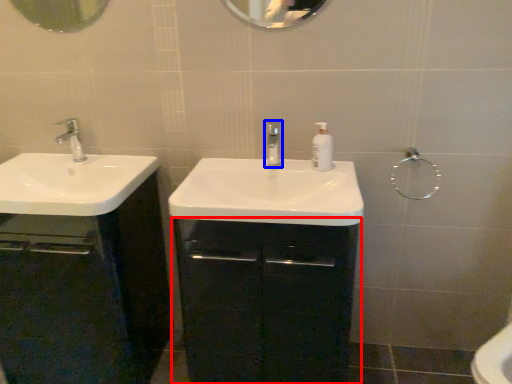
Question: Which of the following is the farthest to the observer, bathroom cabinet (highlighted by a red box) or tap (highlighted by a blue box)?

Choices:
 (A) bathroom cabinet
 (B) tap

Answer: (B)